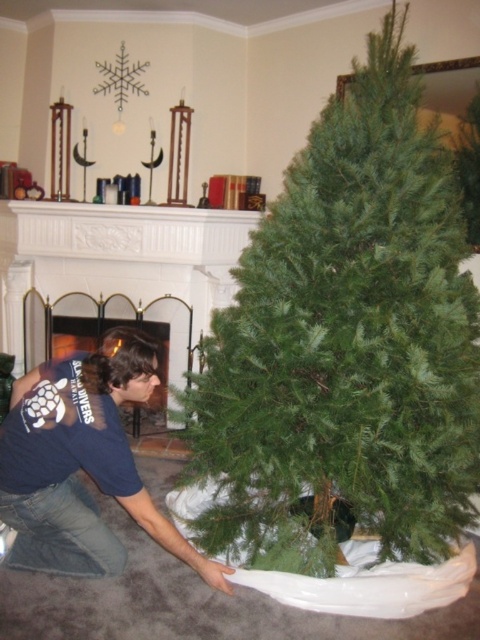
Question: Where is dark blue t-shirt at lower left located in relation to green needle-like at center in the image?

Choices:
 (A) below
 (B) above

Answer: (A)

Question: Is green matte christmas tree at center closer to the viewer compared to dark blue t-shirt at lower left?

Choices:
 (A) yes
 (B) no

Answer: (A)

Question: Is matte white fireplace at center positioned behind green needle-like at center?

Choices:
 (A) yes
 (B) no

Answer: (A)

Question: Which point is farther to the camera?

Choices:
 (A) green matte christmas tree at center
 (B) dark blue t-shirt at lower left
 (C) green needle-like at center

Answer: (C)

Question: Which object appears farthest from the camera in this image?

Choices:
 (A) matte white fireplace at center
 (B) green needle-like at center
 (C) dark blue t-shirt at lower left
 (D) green matte christmas tree at center

Answer: (A)

Question: Which point is closer to the camera taking this photo?

Choices:
 (A) (213, 529)
 (B) (466, 198)

Answer: (A)